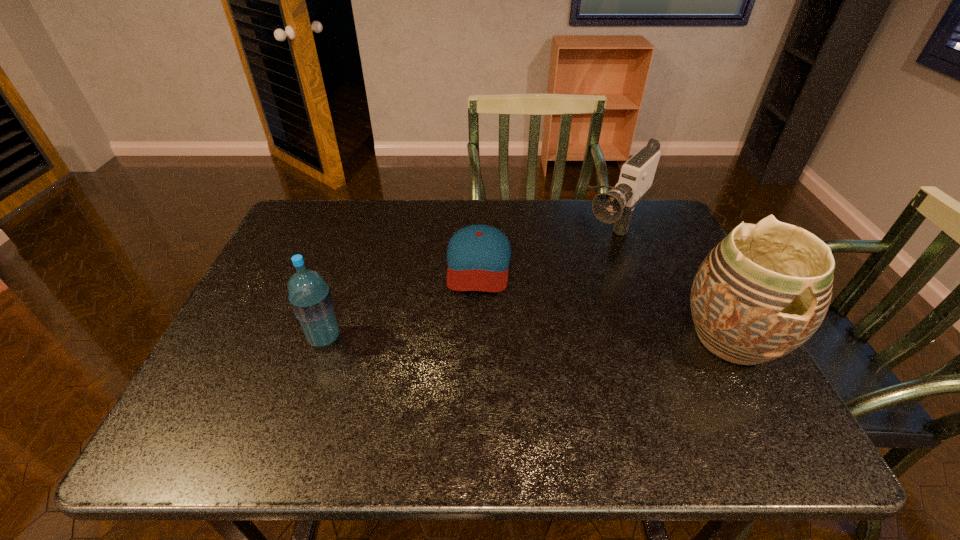
Where is `free point between the pottery and the second object from left to right`? free point between the pottery and the second object from left to right is located at coordinates (605, 300).

Locate an element on the screen. The width and height of the screenshot is (960, 540). vacant area between the shortest object and the water bottle is located at coordinates (401, 300).

Locate which object ranks third in proximity to the camcorder. Please provide its 2D coordinates. Your answer should be formatted as a tuple, i.e. [(x, y)], where the tuple contains the x and y coordinates of a point satisfying the conditions above.

[(310, 297)]

You are a GUI agent. You are given a task and a screenshot of the screen. Output one action in this format:
    pyautogui.click(x=<x>, y=<y>)
    Task: Click on the object that is the closest to the water bottle
    Image resolution: width=960 pixels, height=540 pixels.
    Given the screenshot: What is the action you would take?
    pyautogui.click(x=478, y=256)

Locate an element on the screen. The width and height of the screenshot is (960, 540). free location that satisfies the following two spatial constraints: 1. on the front side of the shortest object; 2. on the left side of the pottery is located at coordinates 479,339.